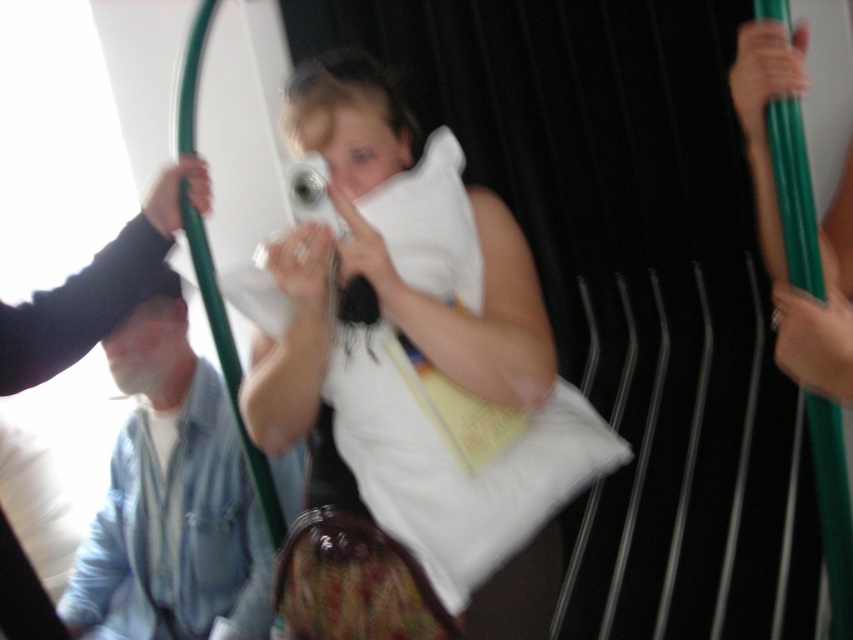
Question: Which object is positioned closest to the black fabric hand at upper left?

Choices:
 (A) denim jacket at lower left
 (B) white soft pillow at center

Answer: (B)

Question: In this image, where is denim jacket at lower left located relative to black fabric hand at upper left?

Choices:
 (A) left
 (B) right

Answer: (A)

Question: Estimate the real-world distances between objects in this image. Which object is farther from the denim jacket at lower left?

Choices:
 (A) black fabric hand at upper left
 (B) white soft pillow at center

Answer: (B)

Question: Is denim jacket at lower left smaller than black fabric hand at upper left?

Choices:
 (A) yes
 (B) no

Answer: (B)

Question: Considering the relative positions of white soft pillow at center and denim jacket at lower left in the image provided, where is white soft pillow at center located with respect to denim jacket at lower left?

Choices:
 (A) below
 (B) above

Answer: (B)

Question: Which object is the closest to the denim jacket at lower left?

Choices:
 (A) white soft pillow at center
 (B) black fabric hand at upper left

Answer: (B)